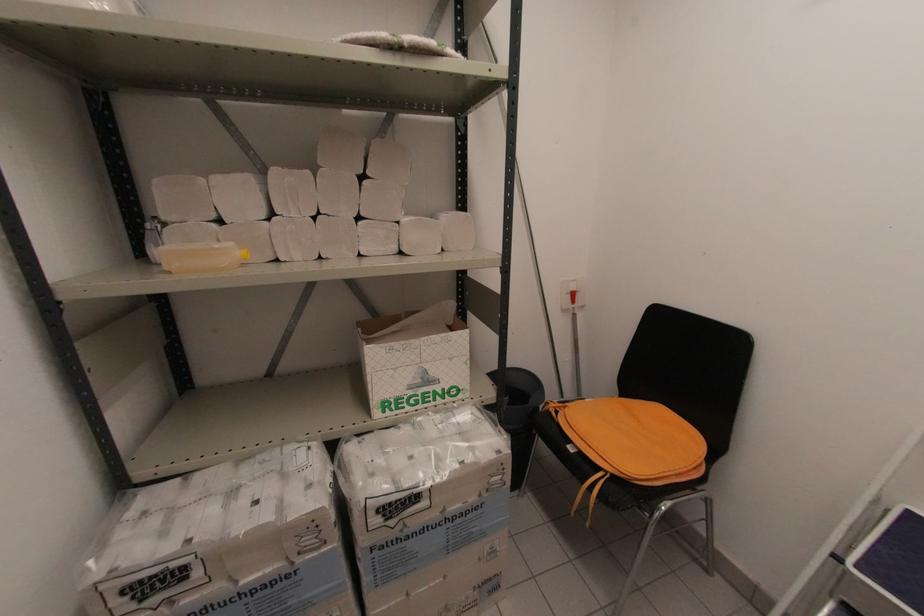
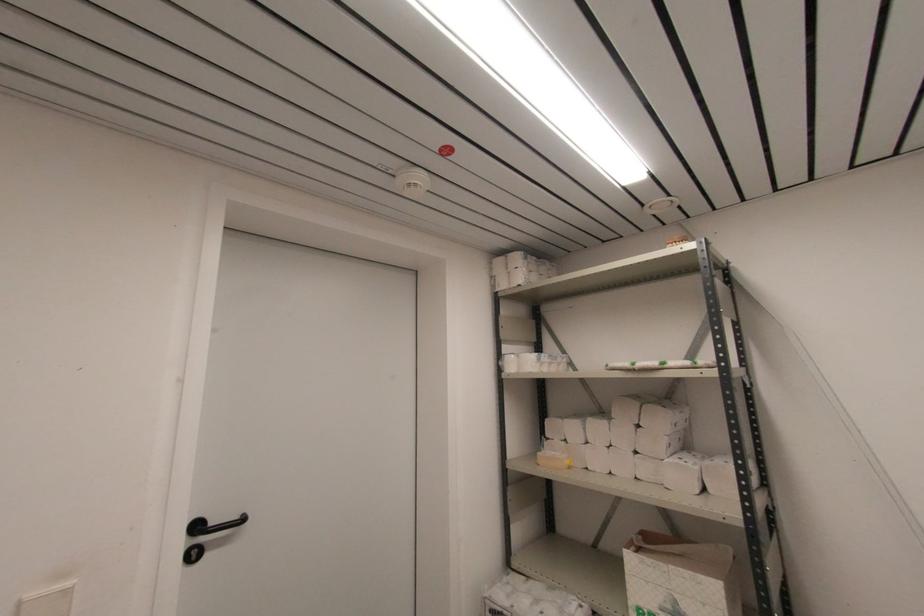
Locate, in the second image, the point that corresponds to pixel 215 179 in the first image.

(566, 421)